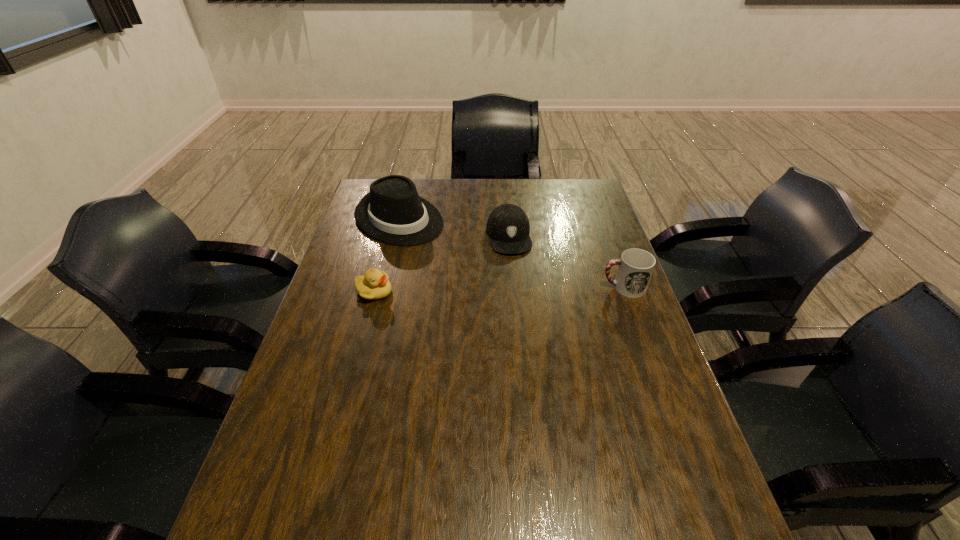
I want to click on duckling, so click(x=374, y=285).

You are a GUI agent. You are given a task and a screenshot of the screen. Output one action in this format:
    pyautogui.click(x=<x>, y=<y>)
    Task: Click on the rightmost object
    
    Given the screenshot: What is the action you would take?
    pyautogui.click(x=635, y=268)

Image resolution: width=960 pixels, height=540 pixels. I want to click on the second object from right to left, so click(508, 227).

Where is `the tallest object`? The image size is (960, 540). the tallest object is located at coordinates (392, 212).

Identify the location of vacant area situated at the face of the duckling. (523, 292).

The image size is (960, 540). I want to click on free region located 0.340m on the side of the rightmost object where the handle is located, so click(488, 287).

Image resolution: width=960 pixels, height=540 pixels. In order to click on vacant space positioned on the side of the rightmost object where the handle is located in this screenshot , I will do `click(527, 287)`.

This screenshot has width=960, height=540. What are the coordinates of `free region located 0.160m on the side of the rightmost object where the handle is located` in the screenshot? It's located at (547, 287).

The width and height of the screenshot is (960, 540). Identify the location of vacant position located 0.140m on the front-facing side of the cap. (517, 285).

Image resolution: width=960 pixels, height=540 pixels. In order to click on vacant area situated on the front-facing side of the cap in this screenshot , I will do click(516, 272).